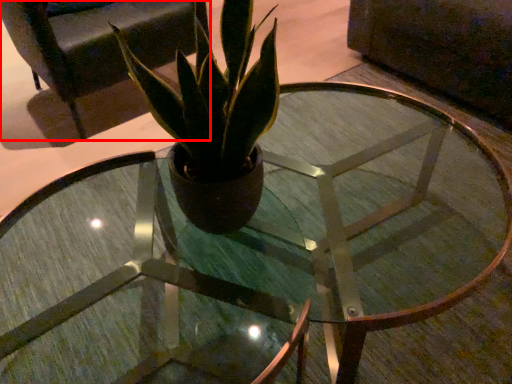
Question: From the image's perspective, where is armchair (annotated by the red box) located in relation to houseplant in the image?

Choices:
 (A) below
 (B) above

Answer: (B)